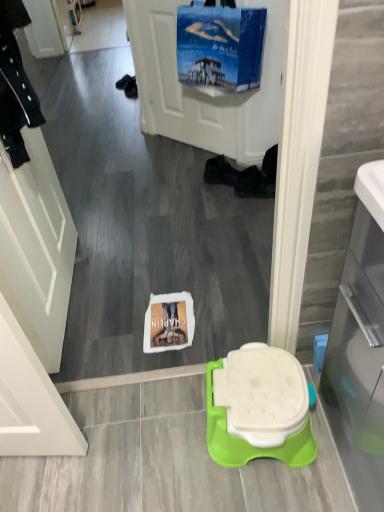
The width and height of the screenshot is (384, 512). In order to click on vacant point to the left of black fabric shoe at center, which is the second footwear from right to left in this screenshot , I will do pos(183,180).